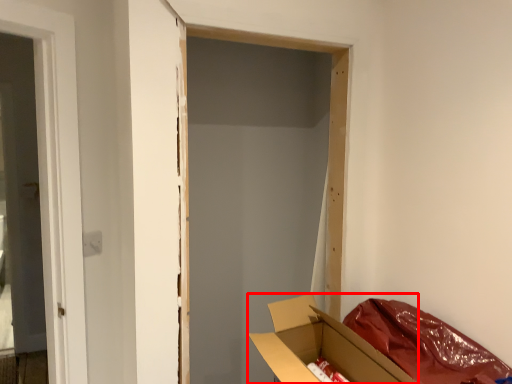
Question: Observing the image, what is the correct spatial positioning of box (annotated by the red box) in reference to curtain?

Choices:
 (A) left
 (B) right

Answer: (A)